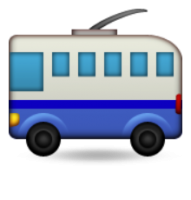
The width and height of the screenshot is (191, 200). I want to click on cord, so click(x=97, y=25).